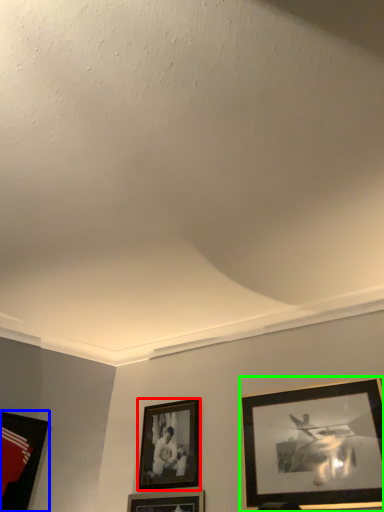
Question: Which object is positioned closest to picture frame (highlighted by a red box)? Select from picture frame (highlighted by a blue box) and picture frame (highlighted by a green box).

Choices:
 (A) picture frame
 (B) picture frame

Answer: (B)